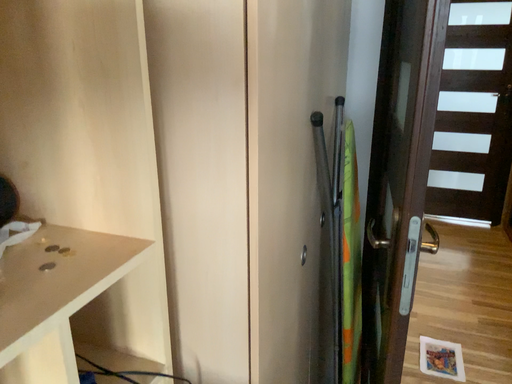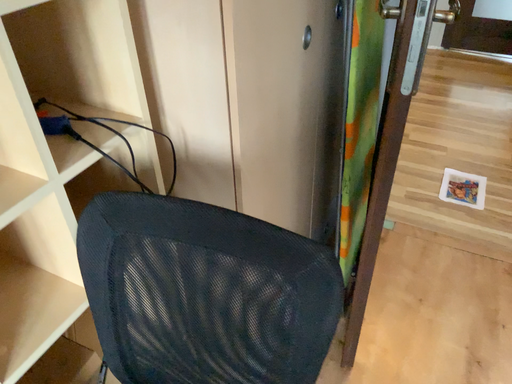
Question: How did the camera likely rotate when shooting the video?

Choices:
 (A) rotated upward
 (B) rotated downward

Answer: (B)